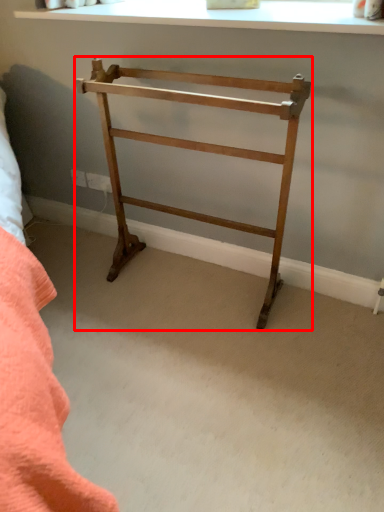
Question: Considering the relative positions of furniture (annotated by the red box) and window in the image provided, where is furniture (annotated by the red box) located with respect to the staircase?

Choices:
 (A) right
 (B) left

Answer: (B)